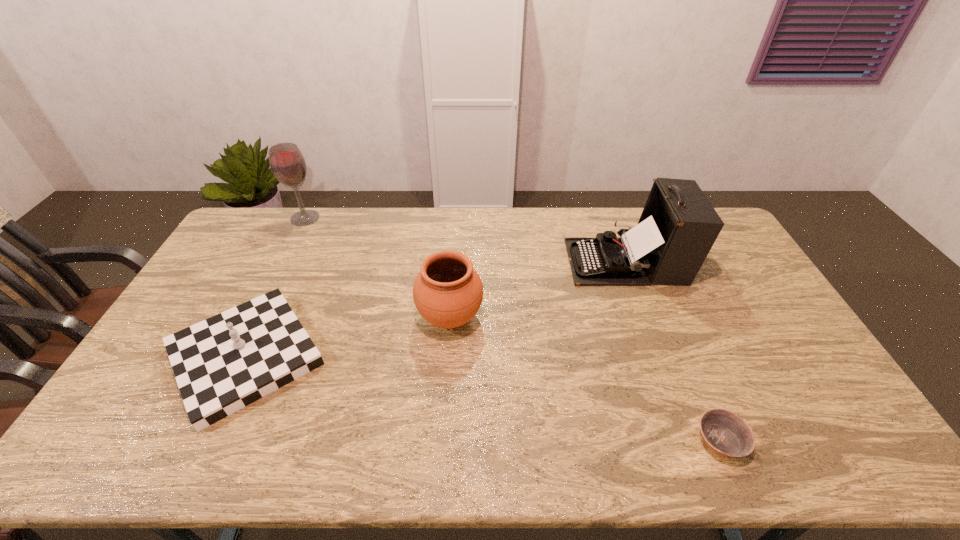
The image size is (960, 540). In order to click on vacant area that lies between the bowl and the third shortest object in this screenshot , I will do `click(586, 379)`.

At what (x,y) coordinates should I click in order to perform the action: click on free space between the farthest object and the fourth nearest object. Please return your answer as a coordinate pair (x, y). Looking at the image, I should click on (466, 240).

Identify the location of unoccupied area between the bowl and the alcohol. This screenshot has width=960, height=540. (513, 329).

Find the location of a particular element. blank region between the second shortest object and the farthest object is located at coordinates (276, 287).

Select which object appears as the second closest to the second shortest object. Please provide its 2D coordinates. Your answer should be formatted as a tuple, i.e. [(x, y)], where the tuple contains the x and y coordinates of a point satisfying the conditions above.

[(287, 163)]

Where is `the fourth closest object to the checkerboard`? the fourth closest object to the checkerboard is located at coordinates (723, 431).

This screenshot has width=960, height=540. I want to click on vacant space that satisfies the following two spatial constraints: 1. on the back side of the fourth tallest object; 2. on the right side of the third object from right to left, so [264, 318].

Where is `free spot that satisfies the following two spatial constraints: 1. on the front side of the shortest object; 2. on the right side of the fourth tallest object`? The image size is (960, 540). free spot that satisfies the following two spatial constraints: 1. on the front side of the shortest object; 2. on the right side of the fourth tallest object is located at coordinates (205, 440).

In order to click on free space that satisfies the following two spatial constraints: 1. inside the open case of the typewriter; 2. on the left side of the bowl in this screenshot , I will do `click(692, 440)`.

The width and height of the screenshot is (960, 540). In order to click on vacant space that satisfies the following two spatial constraints: 1. on the front side of the farthest object; 2. on the right side of the third tallest object in this screenshot , I will do `click(255, 318)`.